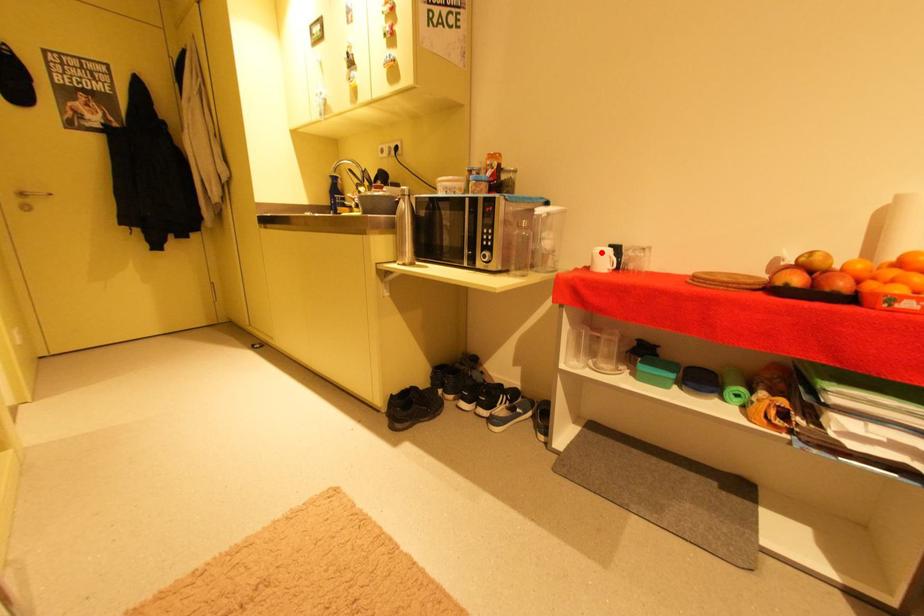
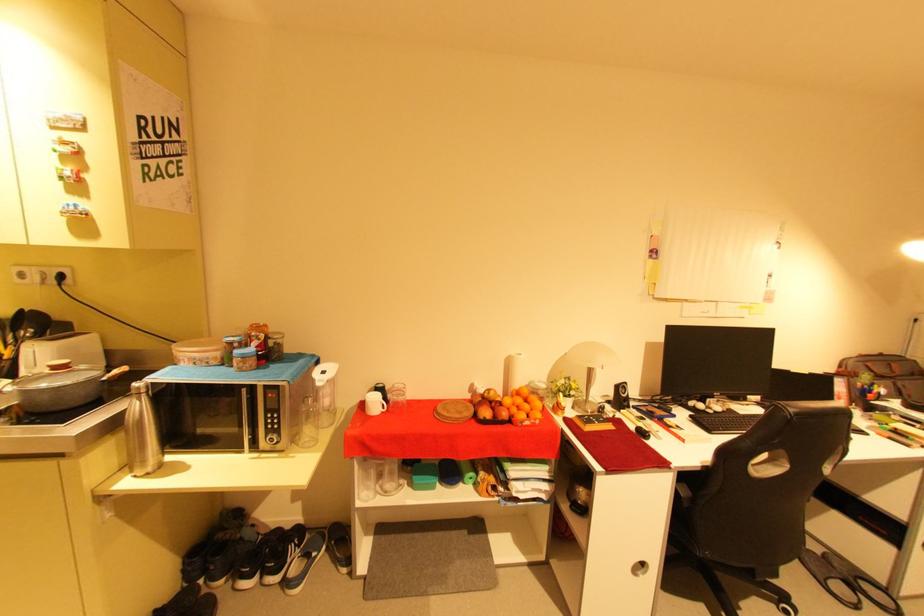
Question: A red point is marked in image1. In image2, is the corresponding 3D point closer to the camera or farther? Reply with the corresponding letter.

Choices:
 (A) The corresponding 3D point is closer.
 (B) The corresponding 3D point is farther.

Answer: (B)